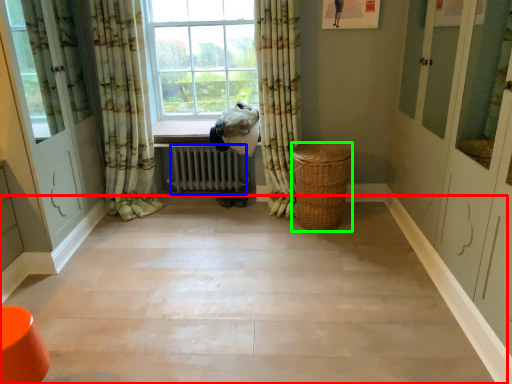
Question: Considering the real-world distances, which object is closest to corridor (highlighted by a red box)? radiator (highlighted by a blue box) or basket (highlighted by a green box).

Choices:
 (A) radiator
 (B) basket

Answer: (B)